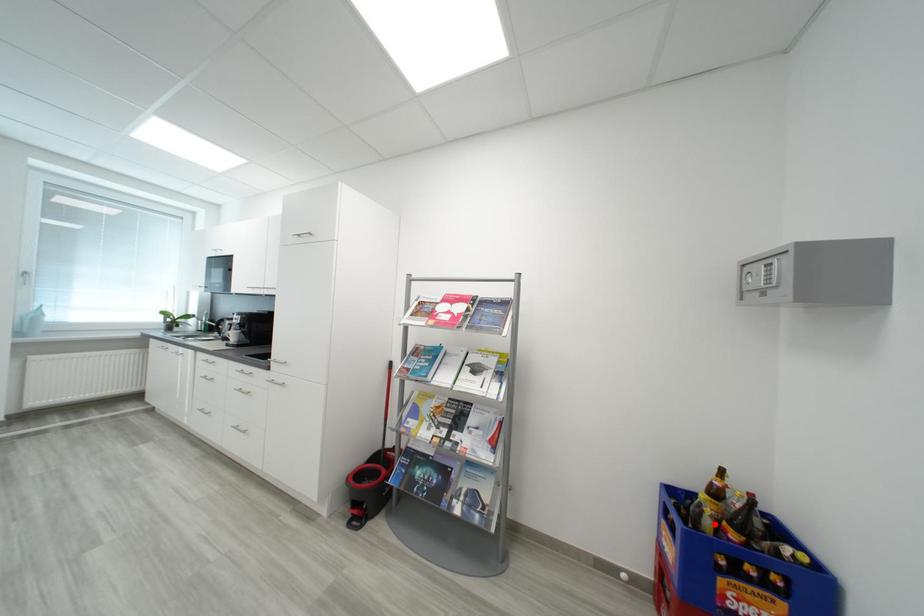
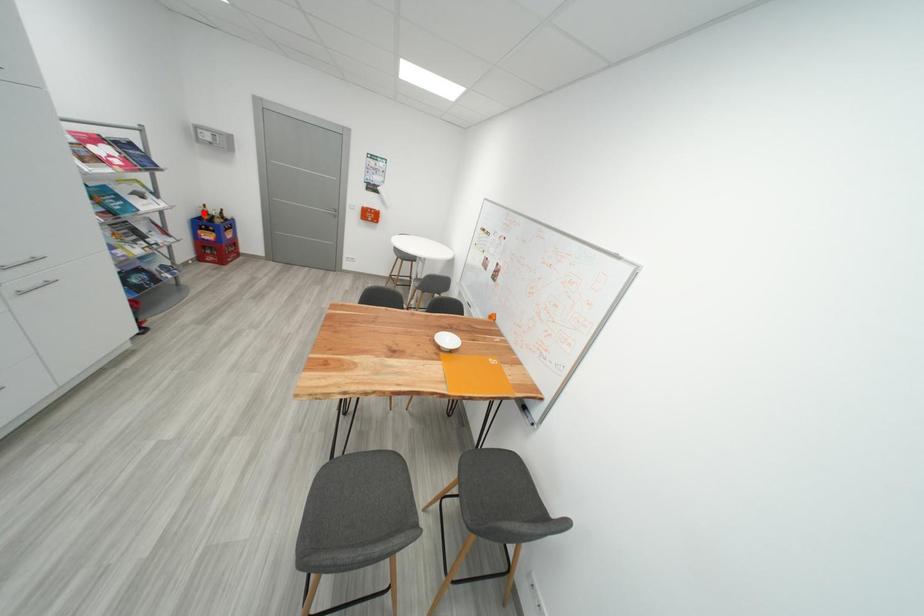
I am providing you with two images of the same scene from different viewpoints. A red point is marked on the first image and another point is marked on the second image. Is the marked point in image1 the same physical position as the marked point in image2?

No